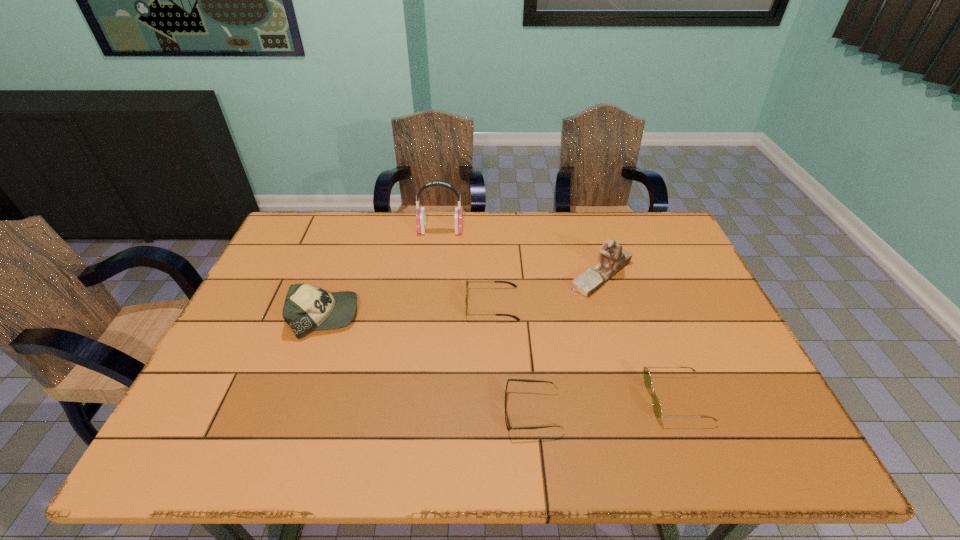
At what (x,y) coordinates should I click in order to perform the action: click on free space located 0.380m on the front-facing side of the figurine. Please return your answer as a coordinate pair (x, y). The image size is (960, 540). Looking at the image, I should click on (441, 275).

Locate an element on the screen. The image size is (960, 540). vacant space located on the front-facing side of the figurine is located at coordinates (473, 275).

Identify the location of vacant space located 0.240m on the front-facing side of the leftmost object. (446, 316).

What are the coordinates of `vacant region located 0.100m on the front-facing side of the farthest sunglasses` in the screenshot? It's located at (430, 303).

I want to click on free space located 0.100m on the front-facing side of the farthest sunglasses, so click(x=430, y=303).

Where is `vacant space located 0.080m on the front-facing side of the farthest sunglasses`? Image resolution: width=960 pixels, height=540 pixels. vacant space located 0.080m on the front-facing side of the farthest sunglasses is located at coordinates (438, 303).

Where is `vacant space located on the front-facing side of the rightmost sunglasses`? This screenshot has width=960, height=540. vacant space located on the front-facing side of the rightmost sunglasses is located at coordinates (474, 398).

Identify the location of vacant space positioned 0.160m on the front-facing side of the rightmost sunglasses. (579, 398).

Locate an element on the screen. Image resolution: width=960 pixels, height=540 pixels. free space located on the front-facing side of the rightmost sunglasses is located at coordinates (627, 398).

This screenshot has height=540, width=960. In order to click on vacant region located on the lenses of the shortest sunglasses in this screenshot , I will do `click(366, 411)`.